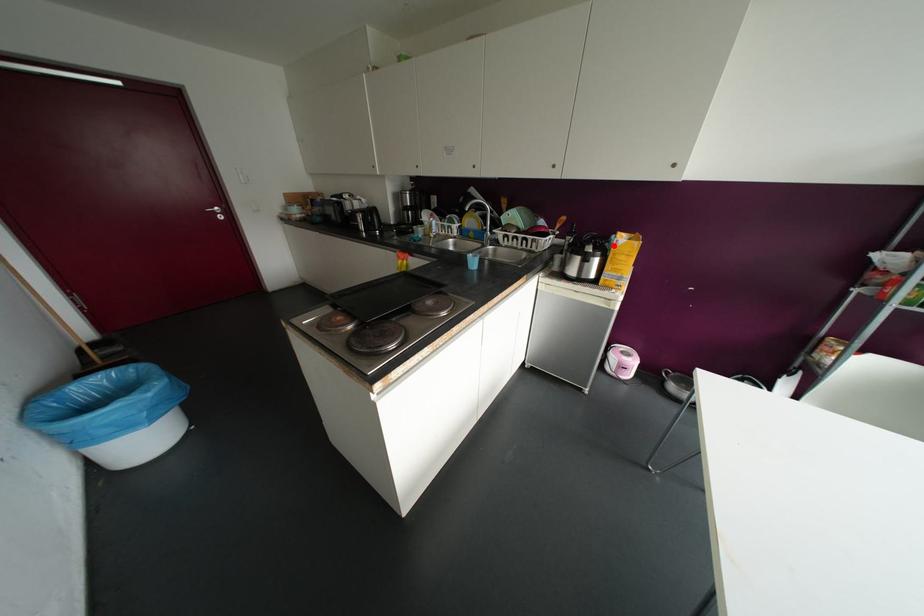
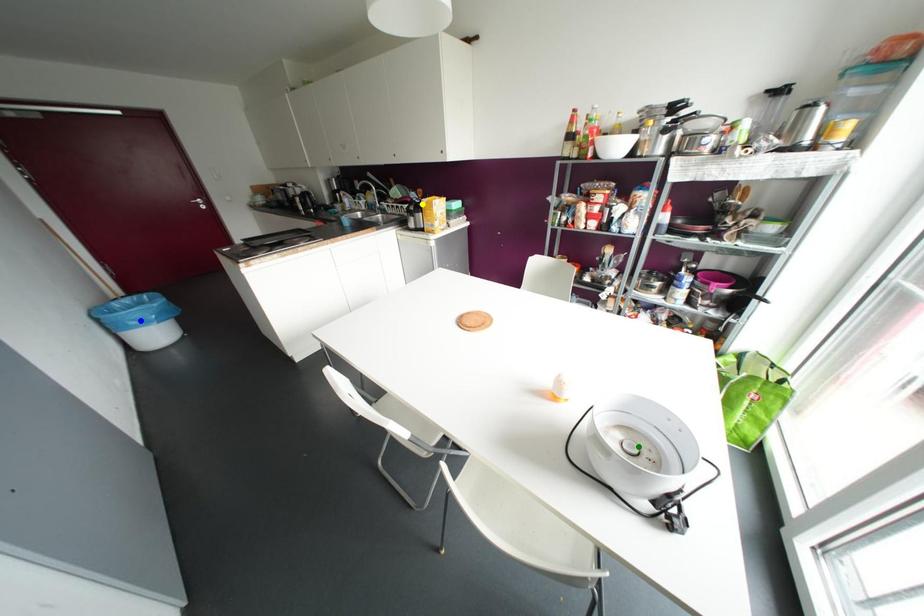
Question: I am providing you with two images of the same scene from different viewpoints. A red point is marked on the first image. You are given multiple points on the second image. Can you choose the point in image 2 that corresponds to the point in image 1?

Choices:
 (A) yellow point
 (B) green point
 (C) blue point

Answer: (A)